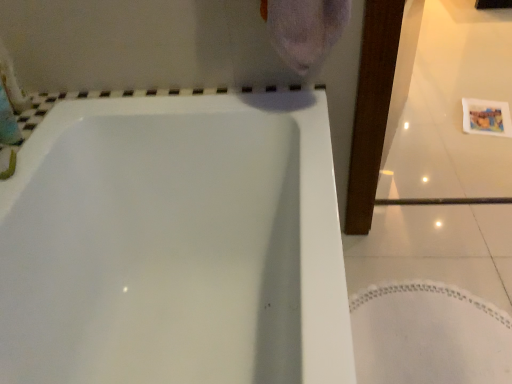
Question: Is white glossy bathtub at center bigger than white fabric bath mat at lower right?

Choices:
 (A) yes
 (B) no

Answer: (A)

Question: Does white glossy bathtub at center lie behind white fabric bath mat at lower right?

Choices:
 (A) yes
 (B) no

Answer: (B)

Question: Is white glossy bathtub at center taller than white fabric bath mat at lower right?

Choices:
 (A) no
 (B) yes

Answer: (B)

Question: Is the position of white glossy bathtub at center less distant than that of white fabric bath mat at lower right?

Choices:
 (A) yes
 (B) no

Answer: (A)

Question: Can you confirm if white glossy bathtub at center is smaller than white fabric bath mat at lower right?

Choices:
 (A) no
 (B) yes

Answer: (A)

Question: Is white glossy bathtub at center touching white fabric bath mat at lower right?

Choices:
 (A) no
 (B) yes

Answer: (A)

Question: Is white fabric bath mat at lower right aimed at white glossy bathtub at center?

Choices:
 (A) yes
 (B) no

Answer: (B)

Question: Is white fabric bath mat at lower right to the left of white glossy bathtub at center from the viewer's perspective?

Choices:
 (A) no
 (B) yes

Answer: (A)

Question: Is white fabric bath mat at lower right far away from white glossy bathtub at center?

Choices:
 (A) yes
 (B) no

Answer: (B)

Question: Considering the relative sizes of white fabric bath mat at lower right and white glossy bathtub at center in the image provided, is white fabric bath mat at lower right taller than white glossy bathtub at center?

Choices:
 (A) no
 (B) yes

Answer: (A)

Question: Would you say white fabric bath mat at lower right is outside white glossy bathtub at center?

Choices:
 (A) no
 (B) yes

Answer: (B)

Question: From the image's perspective, is white fabric bath mat at lower right on white glossy bathtub at center?

Choices:
 (A) yes
 (B) no

Answer: (B)

Question: From the image's perspective, relative to white fabric bath mat at lower right, is white glossy bathtub at center above or below?

Choices:
 (A) below
 (B) above

Answer: (B)